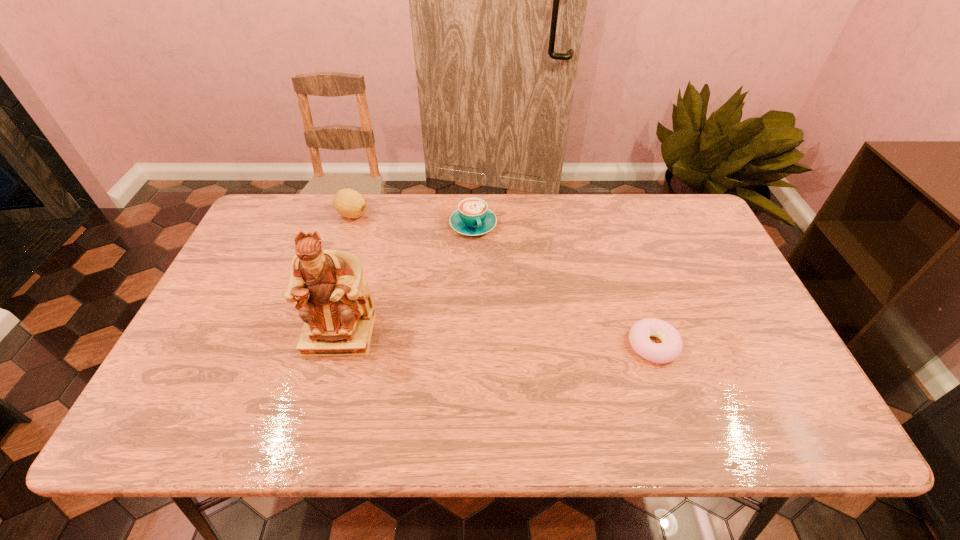
Locate an element on the screen. The width and height of the screenshot is (960, 540). vacant space located with the handle on the right side of the second object from right to left is located at coordinates (523, 332).

Where is `vacant space situated at the stem end of the second tallest object`? This screenshot has width=960, height=540. vacant space situated at the stem end of the second tallest object is located at coordinates (412, 289).

At what (x,y) coordinates should I click in order to perform the action: click on vacant space located 0.140m at the stem end of the second tallest object. Please return your answer as a coordinate pair (x, y). The height and width of the screenshot is (540, 960). Looking at the image, I should click on (379, 247).

I want to click on vacant space situated 0.330m at the stem end of the second tallest object, so click(409, 285).

Find the location of a particular element. cappuccino located in the far edge section of the desktop is located at coordinates (472, 217).

Locate an element on the screen. The height and width of the screenshot is (540, 960). lemon located in the far edge section of the desktop is located at coordinates (349, 203).

Locate an element on the screen. The width and height of the screenshot is (960, 540). object located at the near edge is located at coordinates (671, 347).

Find the location of `vacant space at the far edge`. vacant space at the far edge is located at coordinates (510, 235).

Identify the location of free region at the near edge of the desktop. This screenshot has width=960, height=540. (673, 379).

Image resolution: width=960 pixels, height=540 pixels. What are the coordinates of `vacant space at the left edge of the desktop` in the screenshot? It's located at (198, 353).